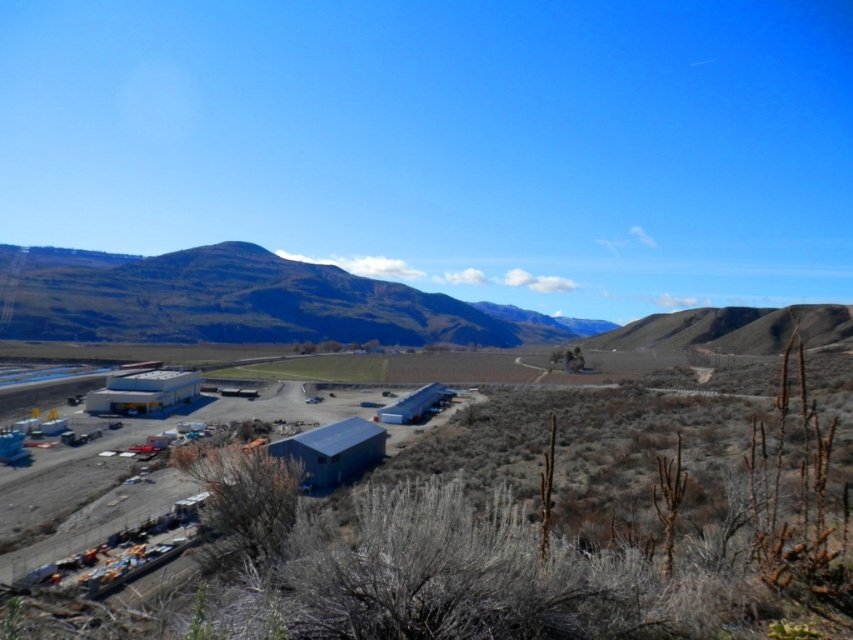
Which is more to the right, blue metallic building at center or brown/dry grassy hill at right?

brown/dry grassy hill at right is more to the right.

Who is positioned more to the left, blue metallic building at center or brown/dry grassy hill at right?

blue metallic building at center

Where is `blue metallic building at center`? blue metallic building at center is located at coordinates (521, 531).

Is point (521, 456) closer to viewer compared to point (306, 269)?

Yes, point (521, 456) is in front of point (306, 269).

In the scene shown: Who is more forward, (566, 460) or (99, 330)?

Point (566, 460) is more forward.

The width and height of the screenshot is (853, 640). I want to click on blue metallic building at center, so click(521, 531).

Between point (173, 273) and point (761, 344), which one is positioned behind?

The point (173, 273) is behind.

Does green grassy hill at upper left have a lesser width compared to brown/dry grassy hill at right?

No.

Is point (129, 276) less distant than point (640, 317)?

Yes, point (129, 276) is closer to viewer.

Locate an element on the screen. The height and width of the screenshot is (640, 853). green grassy hill at upper left is located at coordinates (242, 301).